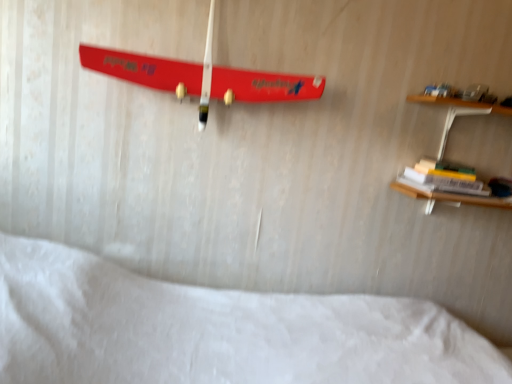
Locate an element on the screen. The image size is (512, 384). shiny red skateboard at upper center is located at coordinates pos(202,77).

The height and width of the screenshot is (384, 512). Describe the element at coordinates (202, 77) in the screenshot. I see `shiny red skateboard at upper center` at that location.

At what (x,y) coordinates should I click in order to perform the action: click on white soft bed at lower center. Please return your answer as a coordinate pair (x, y). Looking at the image, I should click on (215, 330).

Describe the element at coordinates (215, 330) in the screenshot. This screenshot has height=384, width=512. I see `white soft bed at lower center` at that location.

Find the location of `hardcover book at right`. hardcover book at right is located at coordinates 445,177.

The height and width of the screenshot is (384, 512). I want to click on shiny red skateboard at upper center, so click(202, 77).

From the image's perspective, which object appears higher, shiny red skateboard at upper center or white soft bed at lower center?

shiny red skateboard at upper center, from the image's perspective.

Does shiny red skateboard at upper center turn towards white soft bed at lower center?

No.

Is shiny red skateboard at upper center situated inside white soft bed at lower center or outside?

shiny red skateboard at upper center is located beyond the bounds of white soft bed at lower center.

Where is `skateboard that appears behind the white soft bed at lower center`? skateboard that appears behind the white soft bed at lower center is located at coordinates (202, 77).

From the image's perspective, is white soft bed at lower center positioned above or below shiny red skateboard at upper center?

Clearly, from the image's perspective, white soft bed at lower center is below shiny red skateboard at upper center.

In the image, is white soft bed at lower center positioned in front of or behind shiny red skateboard at upper center?

In the image, white soft bed at lower center appears in front of shiny red skateboard at upper center.

Which point is more forward, (111, 315) or (106, 72)?

The point (111, 315) is more forward.

From a real-world perspective, which object stands above the other?

In real-world perspective, shiny red skateboard at upper center is above.

Find the location of `book that is under the shiny red skateboard at upper center (from a real-world perspective)`. book that is under the shiny red skateboard at upper center (from a real-world perspective) is located at coordinates (445, 177).

Considering the relative sizes of white soft bed at lower center and hardcover book at right in the image provided, is white soft bed at lower center shorter than hardcover book at right?

In fact, white soft bed at lower center may be taller than hardcover book at right.

Which point is more distant from viewer, [29,274] or [470,168]?

Positioned behind is point [470,168].

From the image's perspective, between white soft bed at lower center and hardcover book at right, who is located below?

white soft bed at lower center.

Looking at this image, from a real-world perspective, which object stands above the other?

shiny red skateboard at upper center is physically above.

Which object is more forward, shiny red skateboard at upper center or hardcover book at right?

shiny red skateboard at upper center.

Could you tell me if shiny red skateboard at upper center is facing hardcover book at right?

No, shiny red skateboard at upper center is not facing towards hardcover book at right.

Measure the distance between hardcover book at right and white soft bed at lower center.

The distance of hardcover book at right from white soft bed at lower center is 31.64 inches.

Considering the relative sizes of hardcover book at right and white soft bed at lower center in the image provided, is hardcover book at right smaller than white soft bed at lower center?

Indeed, hardcover book at right has a smaller size compared to white soft bed at lower center.

From a real-world perspective, which is physically below, hardcover book at right or white soft bed at lower center?

In real-world perspective, white soft bed at lower center is lower.

Is hardcover book at right with white soft bed at lower center?

hardcover book at right and white soft bed at lower center are clearly separated.

Locate an element on the screen. This screenshot has width=512, height=384. skateboard lying behind the white soft bed at lower center is located at coordinates (202, 77).

Identify the location of skateboard above the white soft bed at lower center (from a real-world perspective). (202, 77).

Looking at the image, which one is located closer to shiny red skateboard at upper center, white soft bed at lower center or hardcover book at right?

Among the two, white soft bed at lower center is located nearer to shiny red skateboard at upper center.

Looking at the image, which one is located closer to hardcover book at right, shiny red skateboard at upper center or white soft bed at lower center?

Based on the image, shiny red skateboard at upper center appears to be nearer to hardcover book at right.

From the image, which object appears to be nearer to white soft bed at lower center, shiny red skateboard at upper center or hardcover book at right?

The object closer to white soft bed at lower center is shiny red skateboard at upper center.

Considering their positions, is hardcover book at right positioned closer to white soft bed at lower center than shiny red skateboard at upper center?

shiny red skateboard at upper center.

Estimate the real-world distances between objects in this image. Which object is further from shiny red skateboard at upper center, hardcover book at right or white soft bed at lower center?

hardcover book at right is further to shiny red skateboard at upper center.

Looking at the image, which one is located closer to hardcover book at right, white soft bed at lower center or shiny red skateboard at upper center?

shiny red skateboard at upper center lies closer to hardcover book at right than the other object.

Image resolution: width=512 pixels, height=384 pixels. In order to click on book that lies between shiny red skateboard at upper center and white soft bed at lower center from top to bottom in this screenshot , I will do `click(445, 177)`.